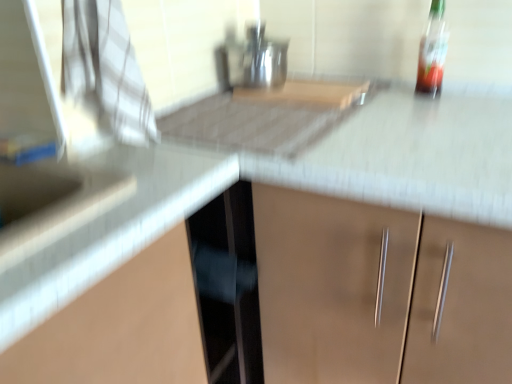
Describe the element at coordinates (103, 229) in the screenshot. I see `white glossy counter top at upper left` at that location.

What are the coordinates of `white glossy counter top at upper left` in the screenshot? It's located at (103, 229).

This screenshot has height=384, width=512. I want to click on translucent glass bottle at upper right, so click(432, 51).

This screenshot has width=512, height=384. What do you see at coordinates (432, 51) in the screenshot?
I see `translucent glass bottle at upper right` at bounding box center [432, 51].

You are a GUI agent. You are given a task and a screenshot of the screen. Output one action in this format:
    pyautogui.click(x=<x>, y=<y>)
    Task: Click on the white glossy counter top at upper left
    This screenshot has height=384, width=512.
    Given the screenshot: What is the action you would take?
    pyautogui.click(x=103, y=229)

Considering the positions of objects translucent glass bottle at upper right and white glossy counter top at upper left in the image provided, who is more to the left, translucent glass bottle at upper right or white glossy counter top at upper left?

white glossy counter top at upper left.

Which object is more forward, translucent glass bottle at upper right or white glossy counter top at upper left?

white glossy counter top at upper left is more forward.

Is point (442, 26) positioned behind point (113, 152)?

Yes.

From the image's perspective, who appears lower, translucent glass bottle at upper right or white glossy counter top at upper left?

white glossy counter top at upper left appears lower in the image.

Consider the image. From a real-world perspective, who is located lower, translucent glass bottle at upper right or white glossy counter top at upper left?

white glossy counter top at upper left, from a real-world perspective.

Can you confirm if translucent glass bottle at upper right is thinner than white glossy counter top at upper left?

Yes, translucent glass bottle at upper right is thinner than white glossy counter top at upper left.

Is translucent glass bottle at upper right taller or shorter than white glossy counter top at upper left?

Considering their sizes, translucent glass bottle at upper right has more height than white glossy counter top at upper left.

Between translucent glass bottle at upper right and white glossy counter top at upper left, which one has smaller size?

translucent glass bottle at upper right.

Is translucent glass bottle at upper right outside of white glossy counter top at upper left?

translucent glass bottle at upper right is positioned outside white glossy counter top at upper left.

Are translucent glass bottle at upper right and white glossy counter top at upper left far apart?

translucent glass bottle at upper right is actually quite close to white glossy counter top at upper left.

Is translucent glass bottle at upper right turned away from white glossy counter top at upper left?

No, translucent glass bottle at upper right's orientation is not away from white glossy counter top at upper left.

Measure the distance from translucent glass bottle at upper right to white glossy counter top at upper left.

28.26 inches.

The height and width of the screenshot is (384, 512). I want to click on counter top below the translucent glass bottle at upper right (from the image's perspective), so click(103, 229).

Considering the relative positions of white glossy counter top at upper left and translucent glass bottle at upper right in the image provided, is white glossy counter top at upper left to the left or to the right of translucent glass bottle at upper right?

white glossy counter top at upper left is to the left of translucent glass bottle at upper right.

Considering the relative positions of white glossy counter top at upper left and translucent glass bottle at upper right in the image provided, is white glossy counter top at upper left in front of translucent glass bottle at upper right?

Yes, white glossy counter top at upper left is closer to the camera.

Which is less distant, (x=11, y=291) or (x=440, y=6)?

Clearly, point (x=11, y=291) is closer to the camera than point (x=440, y=6).

From the image's perspective, is white glossy counter top at upper left above or below translucent glass bottle at upper right?

Clearly, from the image's perspective, white glossy counter top at upper left is below translucent glass bottle at upper right.

From a real-world perspective, between white glossy counter top at upper left and translucent glass bottle at upper right, who is vertically lower?

white glossy counter top at upper left.

Between white glossy counter top at upper left and translucent glass bottle at upper right, which one has larger width?

white glossy counter top at upper left is wider.

Considering the sizes of white glossy counter top at upper left and translucent glass bottle at upper right in the image, is white glossy counter top at upper left taller or shorter than translucent glass bottle at upper right?

white glossy counter top at upper left is shorter than translucent glass bottle at upper right.

Does white glossy counter top at upper left have a larger size compared to translucent glass bottle at upper right?

Yes.

Is white glossy counter top at upper left not inside translucent glass bottle at upper right?

Absolutely, white glossy counter top at upper left is external to translucent glass bottle at upper right.

Is white glossy counter top at upper left not near translucent glass bottle at upper right?

white glossy counter top at upper left is actually quite close to translucent glass bottle at upper right.

Is white glossy counter top at upper left oriented away from translucent glass bottle at upper right?

No, white glossy counter top at upper left is not facing away from translucent glass bottle at upper right.

How different are the orientations of white glossy counter top at upper left and translucent glass bottle at upper right in degrees?

white glossy counter top at upper left and translucent glass bottle at upper right are facing 88.8 degrees away from each other.

Where is `bottle located on the right of white glossy counter top at upper left`? This screenshot has width=512, height=384. bottle located on the right of white glossy counter top at upper left is located at coordinates (432, 51).

Identify the location of bottle above the white glossy counter top at upper left (from the image's perspective). (432, 51).

Locate an element on the screen. bottle behind the white glossy counter top at upper left is located at coordinates (432, 51).